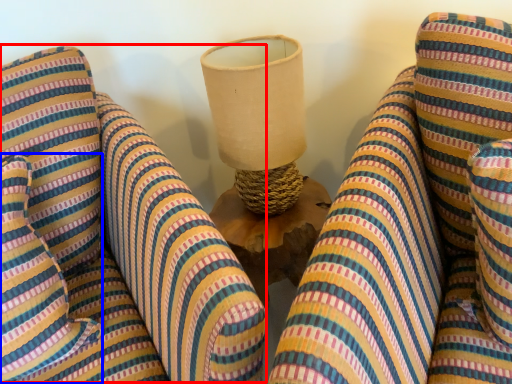
Question: Among these objects, which one is nearest to the camera, bean bag chair (highlighted by a red box) or pillow (highlighted by a blue box)?

Choices:
 (A) bean bag chair
 (B) pillow

Answer: (A)